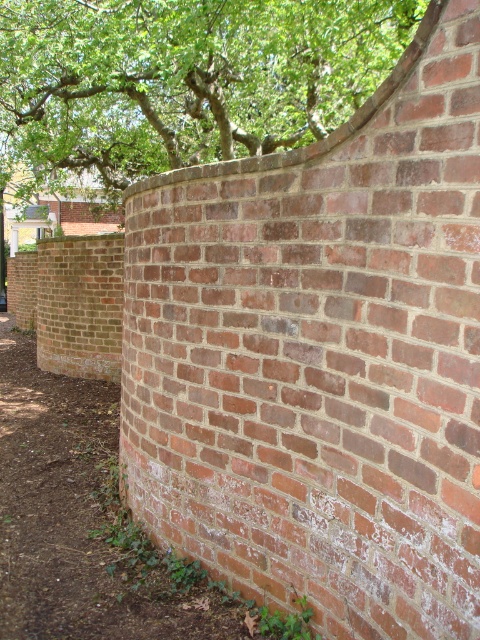
Question: Can you confirm if green leafy tree at upper center is bigger than brick wall at center?

Choices:
 (A) yes
 (B) no

Answer: (A)

Question: Does green leafy tree at upper center lie behind brick wall at center?

Choices:
 (A) no
 (B) yes

Answer: (B)

Question: Which object appears closest to the camera in this image?

Choices:
 (A) green leafy tree at upper center
 (B) brick wall at center

Answer: (B)

Question: Which object appears farthest from the camera in this image?

Choices:
 (A) brick wall at center
 (B) green leafy tree at upper center

Answer: (B)

Question: Can you confirm if green leafy tree at upper center is smaller than brick wall at center?

Choices:
 (A) no
 (B) yes

Answer: (A)

Question: Among these points, which one is farthest from the camera?

Choices:
 (A) (286, 112)
 (B) (75, 586)

Answer: (A)